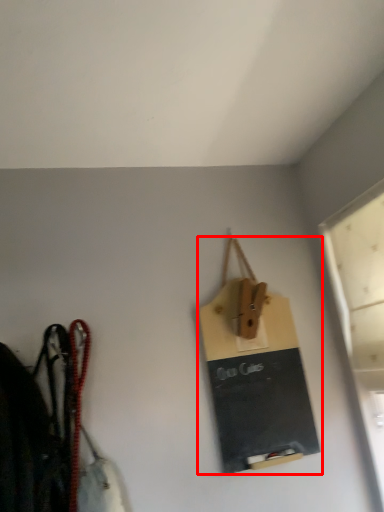
Question: From the image's perspective, what is the correct spatial positioning of handbag (annotated by the red box) in reference to window?

Choices:
 (A) below
 (B) above

Answer: (A)